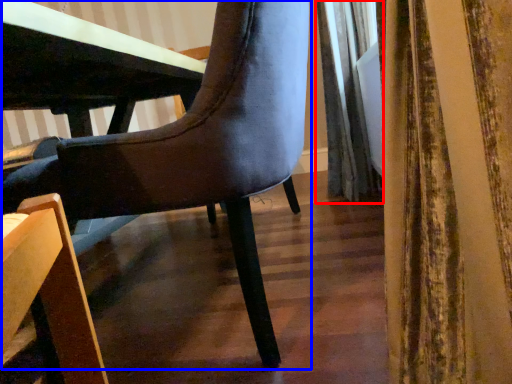
Question: Among these objects, which one is farthest to the camera, curtain (highlighted by a red box) or chair (highlighted by a blue box)?

Choices:
 (A) curtain
 (B) chair

Answer: (A)